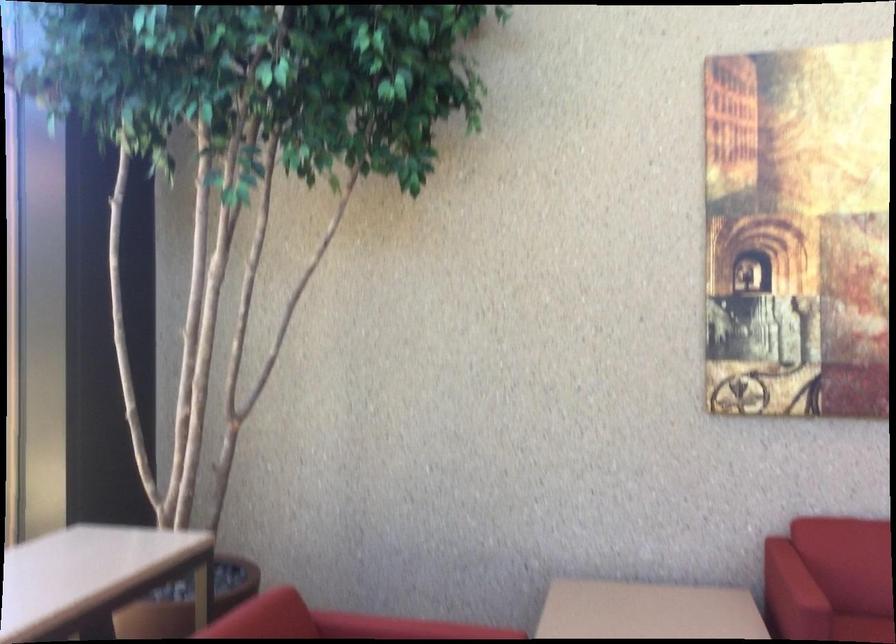
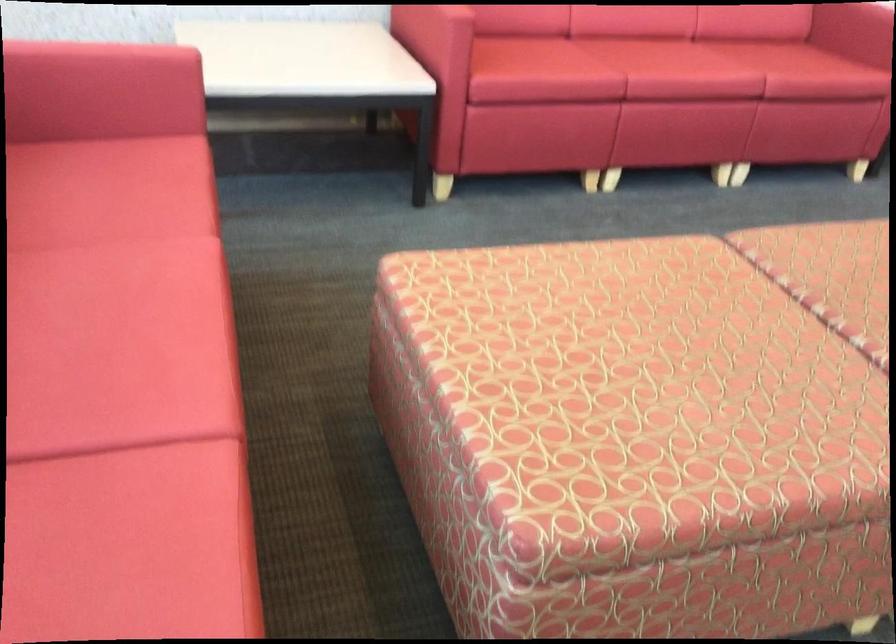
The images are taken continuously from a first-person perspective. In which direction is your viewpoint rotating?

The camera rotated toward right-down.